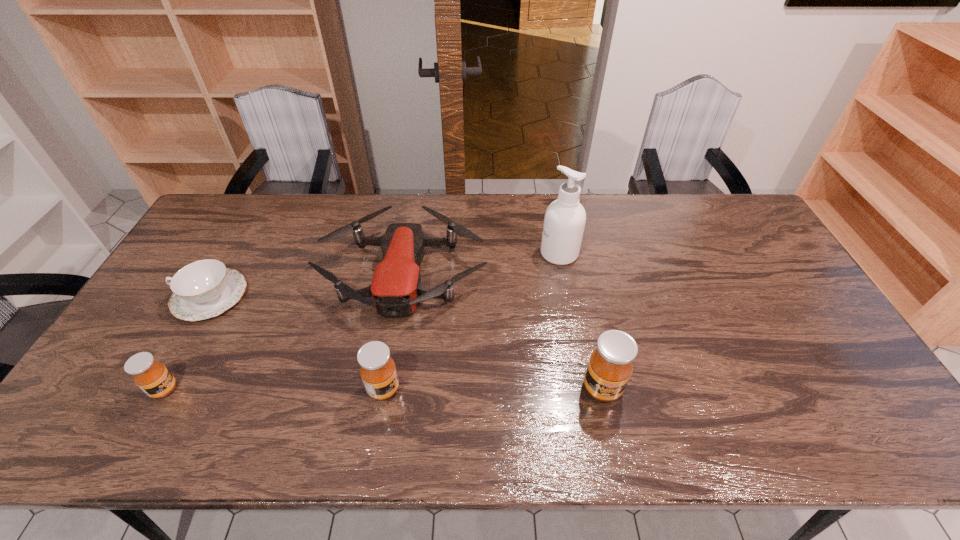
Find the location of a particular element. The width and height of the screenshot is (960, 540). blank space located on the front label of the tallest object is located at coordinates point(479,254).

Locate an element on the screen. The image size is (960, 540). vacant area situated on the front label of the tallest object is located at coordinates (423, 254).

I want to click on free spot located 0.370m on the front label of the tallest object, so click(x=426, y=254).

The height and width of the screenshot is (540, 960). I want to click on free region located on the front-facing side of the drone, so click(381, 403).

Where is `object positioned at the far edge`? object positioned at the far edge is located at coordinates (396, 288).

This screenshot has width=960, height=540. I want to click on honey located at the left edge, so point(153,378).

This screenshot has height=540, width=960. Identify the location of chinaware present at the left edge. (203, 289).

The image size is (960, 540). I want to click on object positioned at the near left corner, so click(x=153, y=378).

At what (x,y) coordinates should I click in order to perform the action: click on vacant space at the far edge of the desktop. Please return your answer as a coordinate pair (x, y). Looking at the image, I should click on (546, 211).

Image resolution: width=960 pixels, height=540 pixels. In order to click on vacant space at the near edge of the desktop in this screenshot , I will do `click(494, 396)`.